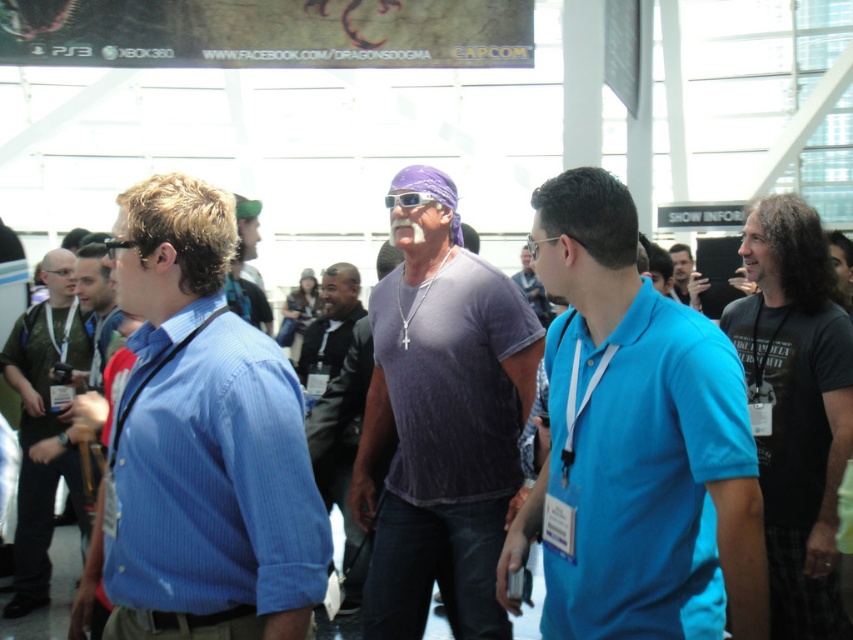
Question: Is black cotton t-shirt at right closer to camera compared to purple bandana at center?

Choices:
 (A) yes
 (B) no

Answer: (A)

Question: Among these objects, which one is farthest from the camera?

Choices:
 (A) blue cotton polo shirt at center
 (B) black cotton t-shirt at right
 (C) blue striped shirt at left

Answer: (B)

Question: Does blue cotton polo shirt at center come behind purple cotton t-shirt at center?

Choices:
 (A) no
 (B) yes

Answer: (A)

Question: Can you confirm if blue striped shirt at left is positioned to the right of black cotton t-shirt at right?

Choices:
 (A) yes
 (B) no

Answer: (B)

Question: Among these points, which one is nearest to the camera?

Choices:
 (A) (251, 241)
 (B) (663, 362)

Answer: (B)

Question: Which object is the closest to the matte blue shirt at left?

Choices:
 (A) blue striped shirt at left
 (B) dark gray t-shirt at center
 (C) purple cotton t-shirt at center
 (D) purple knit sweater at center

Answer: (D)